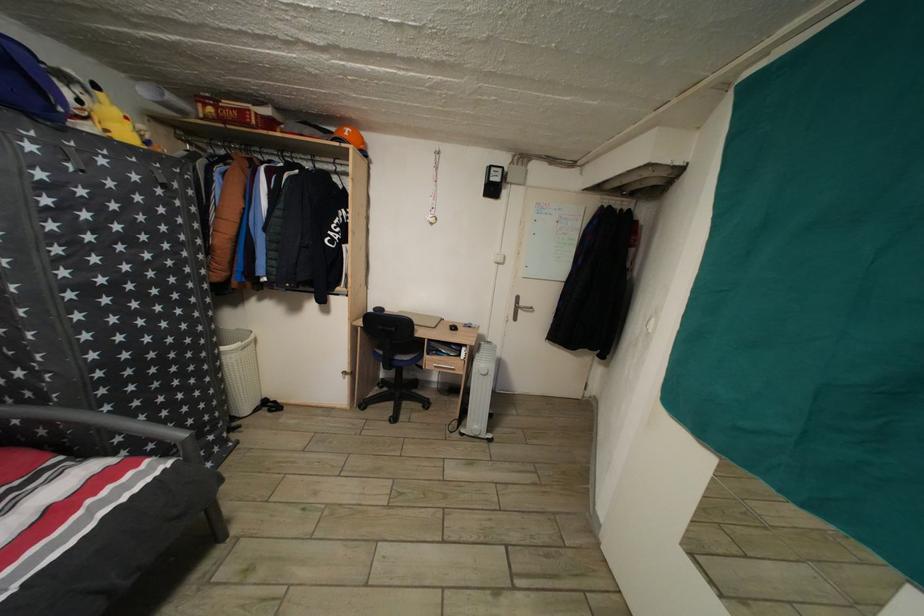
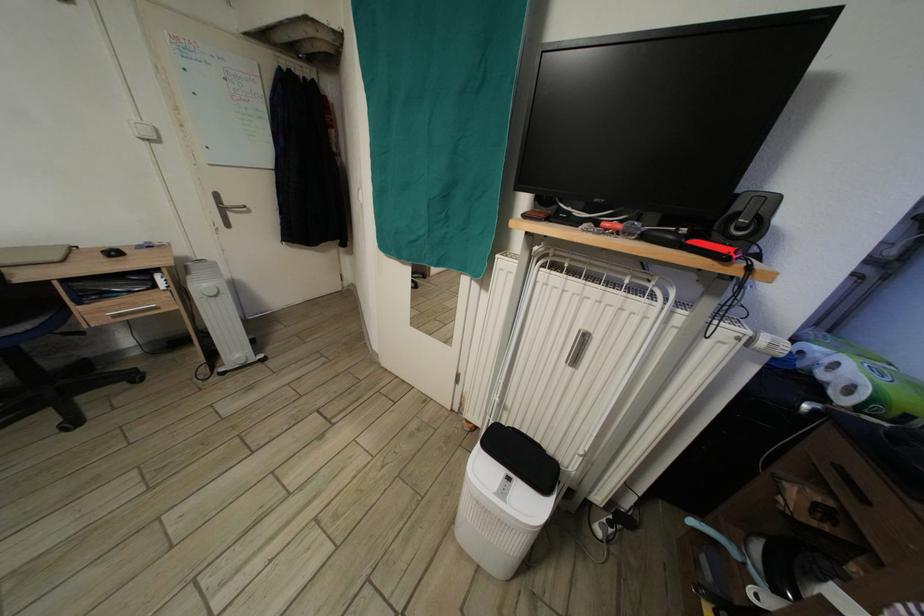
In the second image, find the point that corresponds to pixel 505 257 in the first image.

(141, 124)